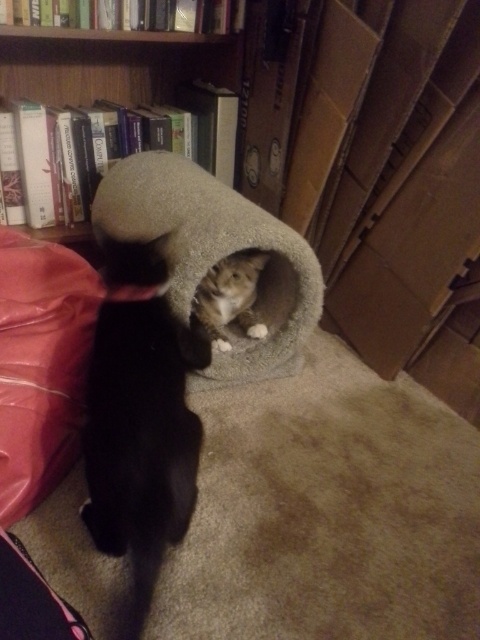
You are a cat owner who wants to place a new toy between the soft gray carpeted cat bed at center and the wooden bookshelf at upper left. Which object should you move closer to the other to create space?

Since the soft gray carpeted cat bed at center is bigger than the wooden bookshelf at upper left, you should move the wooden bookshelf at upper left closer to the cat bed to create space for the new toy.

You are a cat owner who wants to ensure your cats have enough space to move around. Given that the fluffy gray cat at center and the soft gray carpeted cat bed at center are both at the center of the image, can you determine which one takes up more space in the scene?

The soft gray carpeted cat bed at center takes up more space in the scene because the fluffy gray cat at center has a smaller size compared to it.